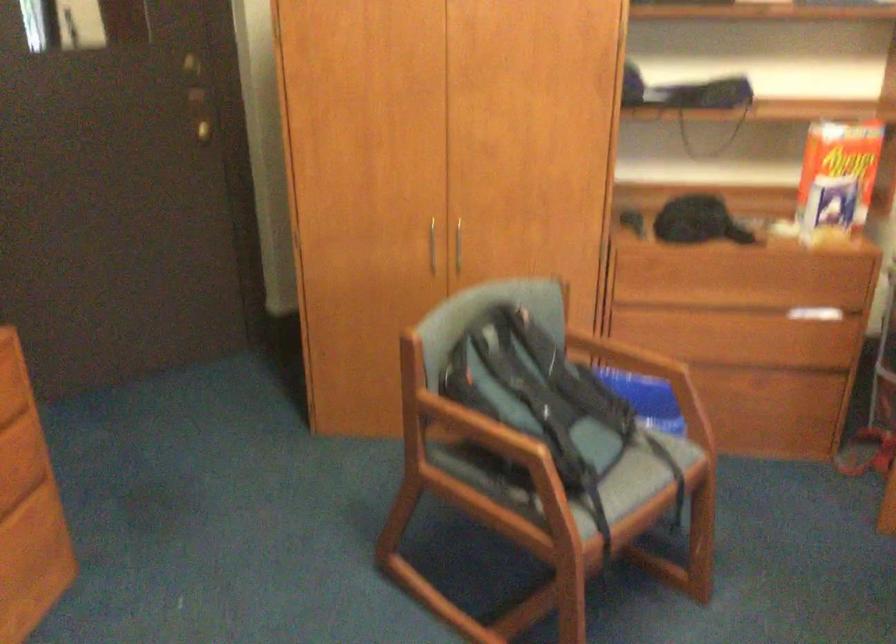
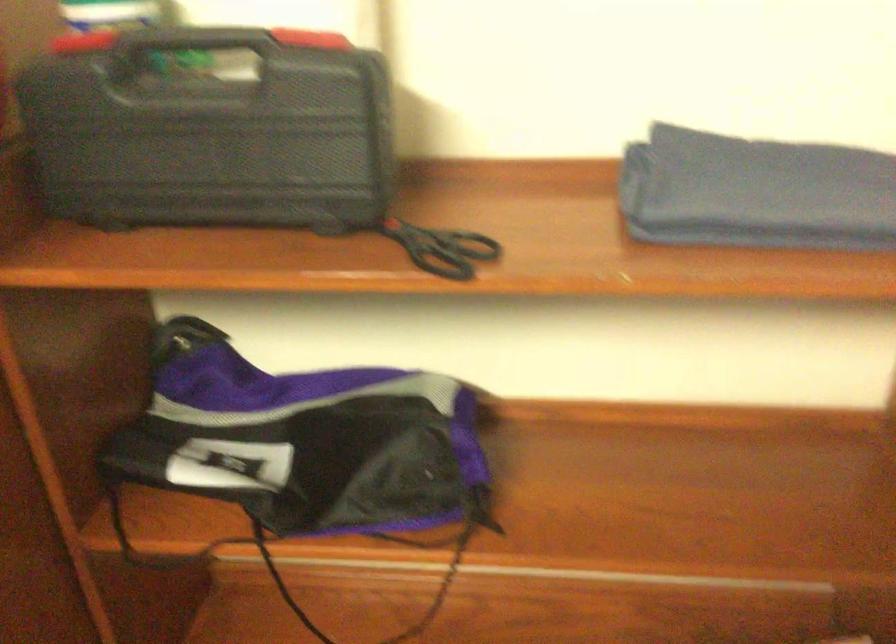
In a continuous first-person perspective shot, in which direction is the camera moving?

The cameraman walked toward right, forward.